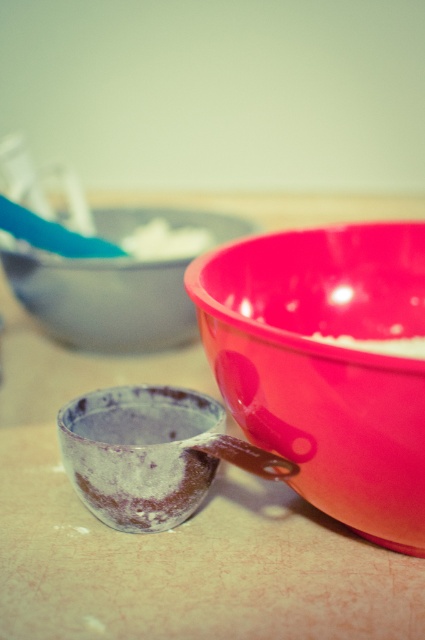
Is matte plastic bowl at upper center to the left of white matte bowl at center from the viewer's perspective?

Correct, you'll find matte plastic bowl at upper center to the left of white matte bowl at center.

Image resolution: width=425 pixels, height=640 pixels. I want to click on matte plastic bowl at upper center, so click(104, 300).

Does point (124, 212) come farther from viewer compared to point (413, 342)?

Yes, it is behind point (413, 342).

I want to click on matte plastic bowl at upper center, so click(x=104, y=300).

Does point (384, 307) come in front of point (184, 236)?

Yes, it is.

Looking at this image, who is more distant from viewer, (331, 417) or (184, 227)?

The point (184, 227) is behind.

Identify the location of glossy plastic bowl at right. The height and width of the screenshot is (640, 425). (325, 364).

Does glossy plastic bowl at right come in front of white matte bowl at center?

That is True.

Is point (269, 368) farther from viewer compared to point (359, 348)?

No.

Measure the distance between glossy plastic bowl at right and camera.

A distance of 14.91 inches exists between glossy plastic bowl at right and camera.

You are a GUI agent. You are given a task and a screenshot of the screen. Output one action in this format:
    pyautogui.click(x=<x>, y=<y>)
    Task: Click on the glossy plastic bowl at right
    The height and width of the screenshot is (640, 425).
    Given the screenshot: What is the action you would take?
    pyautogui.click(x=325, y=364)